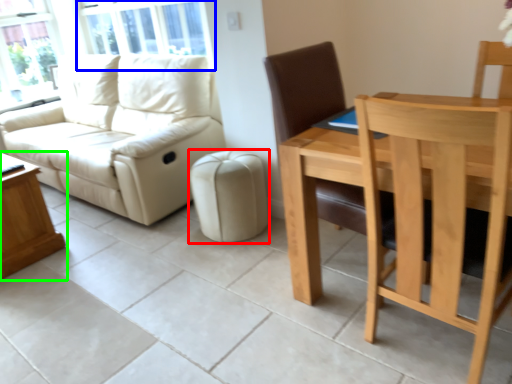
Question: Estimate the real-world distances between objects in this image. Which object is farther from stool (highlighted by a red box), window screen (highlighted by a blue box) or table (highlighted by a green box)?

Choices:
 (A) window screen
 (B) table

Answer: (A)